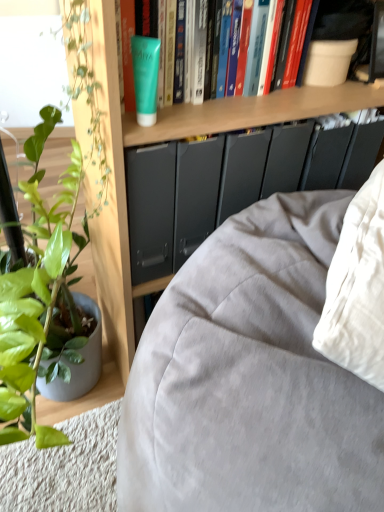
Question: Is green matte tube at upper center facing towards matte gray fabric couch at lower left?

Choices:
 (A) yes
 (B) no

Answer: (B)

Question: From the image's perspective, would you say green matte tube at upper center is positioned over matte gray fabric couch at lower left?

Choices:
 (A) no
 (B) yes

Answer: (B)

Question: Is green matte tube at upper center not near matte gray fabric couch at lower left?

Choices:
 (A) no
 (B) yes

Answer: (A)

Question: Considering the relative sizes of green matte tube at upper center and matte gray fabric couch at lower left in the image provided, is green matte tube at upper center wider than matte gray fabric couch at lower left?

Choices:
 (A) no
 (B) yes

Answer: (A)

Question: Can you see green matte tube at upper center touching matte gray fabric couch at lower left?

Choices:
 (A) no
 (B) yes

Answer: (A)

Question: Is green matte tube at upper center to the left of matte gray fabric couch at lower left from the viewer's perspective?

Choices:
 (A) yes
 (B) no

Answer: (A)

Question: Considering the relative sizes of green matte tube at upper center and wooden bookshelf at upper center in the image provided, is green matte tube at upper center wider than wooden bookshelf at upper center?

Choices:
 (A) no
 (B) yes

Answer: (A)

Question: Would you consider green matte tube at upper center to be distant from wooden bookshelf at upper center?

Choices:
 (A) yes
 (B) no

Answer: (B)

Question: Considering the relative sizes of green matte tube at upper center and wooden bookshelf at upper center in the image provided, is green matte tube at upper center bigger than wooden bookshelf at upper center?

Choices:
 (A) yes
 (B) no

Answer: (B)

Question: From the image's perspective, is green matte tube at upper center above wooden bookshelf at upper center?

Choices:
 (A) no
 (B) yes

Answer: (B)

Question: From a real-world perspective, is green matte tube at upper center positioned over wooden bookshelf at upper center based on gravity?

Choices:
 (A) yes
 (B) no

Answer: (A)

Question: Considering the relative sizes of green matte tube at upper center and wooden bookshelf at upper center in the image provided, is green matte tube at upper center thinner than wooden bookshelf at upper center?

Choices:
 (A) yes
 (B) no

Answer: (A)

Question: Would you say green matte tube at upper center is outside green matte tube at upper center?

Choices:
 (A) no
 (B) yes

Answer: (B)